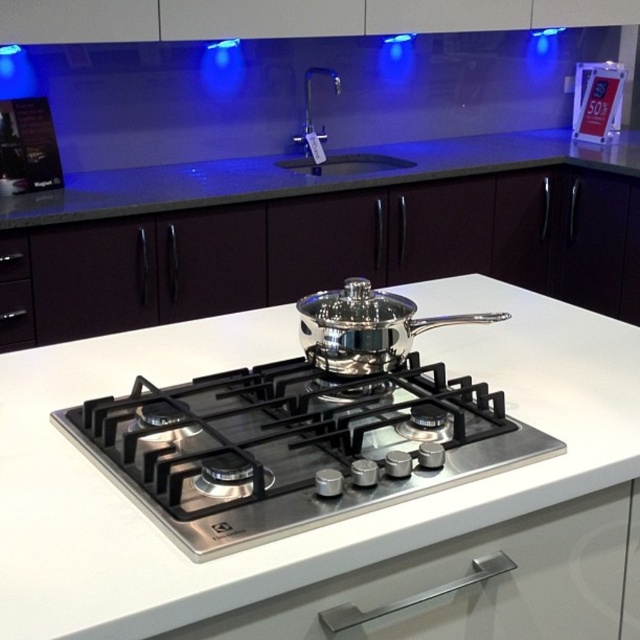
Between dark gray laminate countertop at center and metallic silver pot at upper right, which one appears on the right side from the viewer's perspective?

metallic silver pot at upper right is more to the right.

Between dark gray laminate countertop at center and metallic silver pot at upper right, which one has less height?

Standing shorter between the two is metallic silver pot at upper right.

Identify the location of dark gray laminate countertop at center. The image size is (640, 640). (307, 176).

Who is positioned more to the left, white glossy countertop at center or metallic silver pot at upper right?

Positioned to the left is white glossy countertop at center.

Does point (106, 371) lie in front of point (600, 113)?

Yes, point (106, 371) is closer to viewer.

I want to click on white glossy countertop at center, so click(x=310, y=529).

Is stainless steel gas stove at center behind black matte drawer at left?

No, stainless steel gas stove at center is in front of black matte drawer at left.

Between point (326, 452) and point (20, 252), which one is positioned behind?

The point (20, 252) is more distant.

Find the location of a particular element. stainless steel gas stove at center is located at coordinates (291, 445).